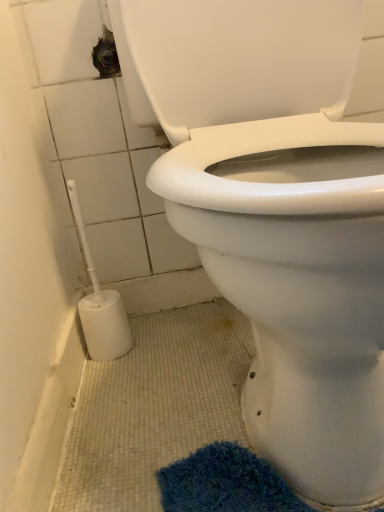
Identify the location of white plastic bidet at lower left. This screenshot has height=512, width=384. (297, 285).

What do you see at coordinates (297, 285) in the screenshot?
I see `white plastic bidet at lower left` at bounding box center [297, 285].

Image resolution: width=384 pixels, height=512 pixels. In order to click on white plastic toilet brush at lower left in this screenshot , I will do `click(100, 305)`.

What do you see at coordinates (100, 305) in the screenshot? Image resolution: width=384 pixels, height=512 pixels. I see `white plastic toilet brush at lower left` at bounding box center [100, 305].

Identify the location of white plastic bidet at lower left. The width and height of the screenshot is (384, 512). (297, 285).

Considering the positions of objects white plastic toilet brush at lower left and white plastic bidet at lower left in the image provided, who is more to the right, white plastic toilet brush at lower left or white plastic bidet at lower left?

Positioned to the right is white plastic bidet at lower left.

Considering their positions, is white plastic toilet brush at lower left located in front of or behind white plastic bidet at lower left?

Visually, white plastic toilet brush at lower left is located behind white plastic bidet at lower left.

Which is farther from the camera, (77, 217) or (243, 409)?

The point (77, 217) is behind.

From the image's perspective, is white plastic toilet brush at lower left located above or below white plastic bidet at lower left?

Clearly, from the image's perspective, white plastic toilet brush at lower left is below white plastic bidet at lower left.

From a real-world perspective, is white plastic toilet brush at lower left positioned over white plastic bidet at lower left based on gravity?

No, from a real-world perspective, white plastic toilet brush at lower left is not above white plastic bidet at lower left.

Does white plastic toilet brush at lower left have a greater width compared to white plastic bidet at lower left?

In fact, white plastic toilet brush at lower left might be narrower than white plastic bidet at lower left.

Who is taller, white plastic toilet brush at lower left or white plastic bidet at lower left?

white plastic bidet at lower left.

Between white plastic toilet brush at lower left and white plastic bidet at lower left, which one has smaller size?

white plastic toilet brush at lower left.

Can white plastic bidet at lower left be found inside white plastic toilet brush at lower left?

No, white plastic toilet brush at lower left does not contain white plastic bidet at lower left.

Is there a large distance between white plastic toilet brush at lower left and white plastic bidet at lower left?

Actually, white plastic toilet brush at lower left and white plastic bidet at lower left are a little close together.

Is white plastic toilet brush at lower left facing away from white plastic bidet at lower left?

No, white plastic toilet brush at lower left is not facing away from white plastic bidet at lower left.

Where is `bidet on the right side of white plastic toilet brush at lower left`? bidet on the right side of white plastic toilet brush at lower left is located at coordinates (297, 285).

Which is more to the left, white plastic bidet at lower left or white plastic toilet brush at lower left?

white plastic toilet brush at lower left.

Is the position of white plastic bidet at lower left less distant than that of white plastic toilet brush at lower left?

Yes, it is.

Which is in front, point (206, 198) or point (72, 180)?

The point (206, 198) is closer to the camera.

From the image's perspective, which is above, white plastic bidet at lower left or white plastic toilet brush at lower left?

white plastic bidet at lower left is shown above in the image.

From a real-world perspective, who is located lower, white plastic bidet at lower left or white plastic toilet brush at lower left?

white plastic toilet brush at lower left is physically lower.

Does white plastic bidet at lower left have a greater width compared to white plastic toilet brush at lower left?

Yes, white plastic bidet at lower left is wider than white plastic toilet brush at lower left.

Considering the sizes of white plastic bidet at lower left and white plastic toilet brush at lower left in the image, is white plastic bidet at lower left taller or shorter than white plastic toilet brush at lower left?

In the image, white plastic bidet at lower left appears to be taller than white plastic toilet brush at lower left.

Considering the sizes of white plastic bidet at lower left and white plastic toilet brush at lower left in the image, is white plastic bidet at lower left bigger or smaller than white plastic toilet brush at lower left?

In the image, white plastic bidet at lower left appears to be larger than white plastic toilet brush at lower left.

Would you say white plastic bidet at lower left is inside or outside white plastic toilet brush at lower left?

white plastic bidet at lower left is located beyond the bounds of white plastic toilet brush at lower left.

Is white plastic bidet at lower left beside white plastic toilet brush at lower left?

white plastic bidet at lower left is not next to white plastic toilet brush at lower left, and they're not touching.

From the picture: Is white plastic bidet at lower left turned away from white plastic toilet brush at lower left?

No, white plastic toilet brush at lower left is not at the back of white plastic bidet at lower left.

Locate an element on the screen. This screenshot has height=512, width=384. brush on the left of white plastic bidet at lower left is located at coordinates (100, 305).

In order to click on bidet above the white plastic toilet brush at lower left (from the image's perspective) in this screenshot , I will do `click(297, 285)`.

Find the location of a particular element. bidet lying in front of the white plastic toilet brush at lower left is located at coordinates (297, 285).